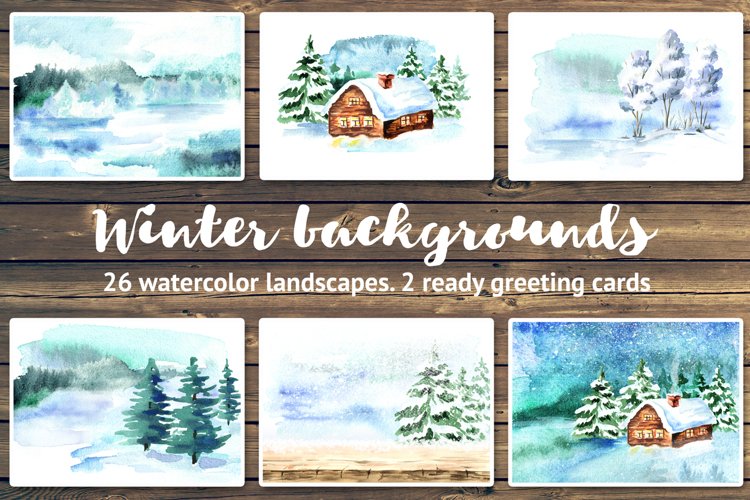
Where is `chimney`? Image resolution: width=750 pixels, height=500 pixels. chimney is located at coordinates (681, 395), (382, 89).